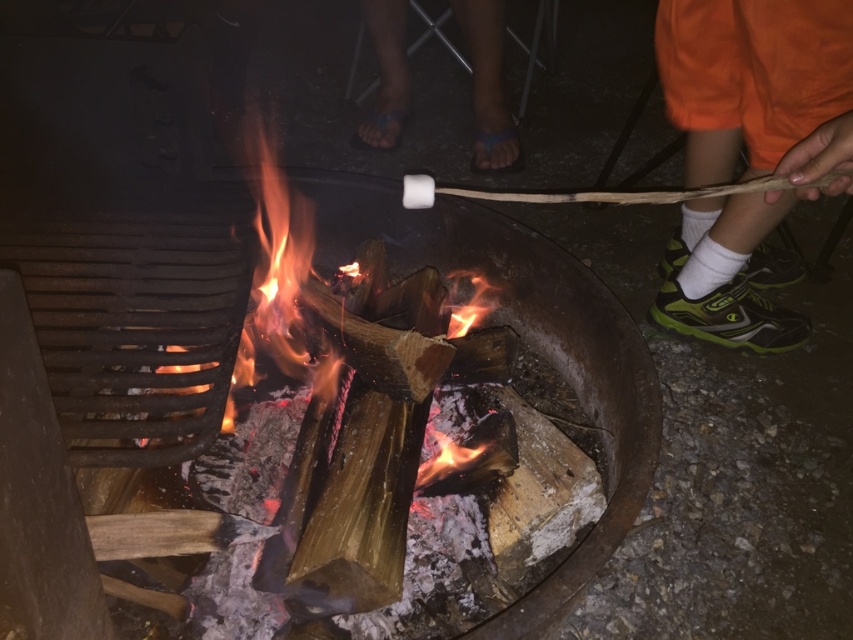
Question: Can you confirm if orange fabric sock at lower right is bigger than blue rubber sandals at center?

Choices:
 (A) no
 (B) yes

Answer: (B)

Question: Is orange fabric sock at lower right wider than blue rubber sandals at center?

Choices:
 (A) yes
 (B) no

Answer: (A)

Question: Among these points, which one is farthest from the camera?

Choices:
 (A) pos(473,102)
 (B) pos(735,120)

Answer: (A)

Question: Which object appears closest to the camera in this image?

Choices:
 (A) orange fabric sock at lower right
 (B) blue rubber sandals at center

Answer: (A)

Question: Can you confirm if orange fabric sock at lower right is wider than blue rubber sandals at center?

Choices:
 (A) no
 (B) yes

Answer: (B)